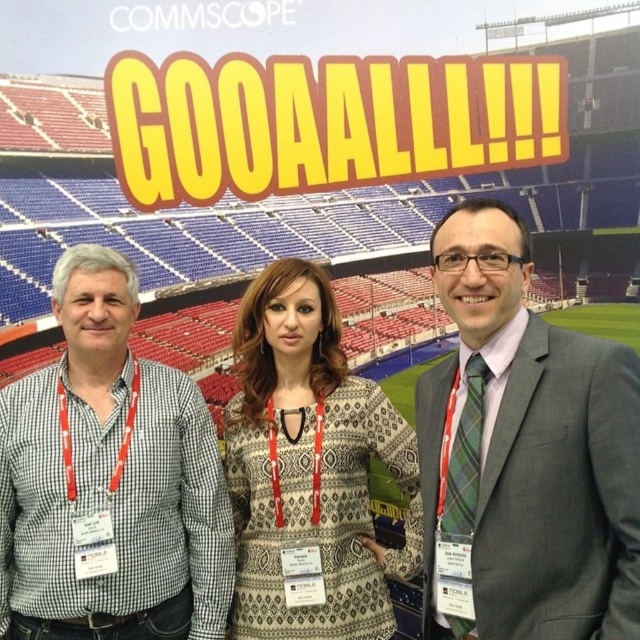
You are a photographer taking a picture of the checkered fabric shirt at left and the patterned fabric dress at center. Which one is closer to the camera?

The checkered fabric shirt at left is closer to the camera because it is in front of the patterned fabric dress at center.

You are a photographer positioned to the right of the backdrop. You need to ensure that both the gray suit at center and the patterned fabric dress at center are fully visible in your photo. Given that the backdrop has limited space, which person should you adjust to avoid cropping the top of their clothing?

The gray suit at center has a greater height compared to the patterned fabric dress at center. Therefore, you should adjust the position of the gray suit at center to avoid cropping its top since it is taller and more likely to be cut off if not properly framed.

You are attending a company event and notice two people in the front row. One is wearing a gray suit at center and the other is wearing a checkered fabric shirt at left. If you want to greet the person who is closer to the stage, which one should you approach?

The gray suit at center is closer to the viewer than the checkered fabric shirt at left, so you should approach the person wearing the gray suit at center since they are nearer to the stage.